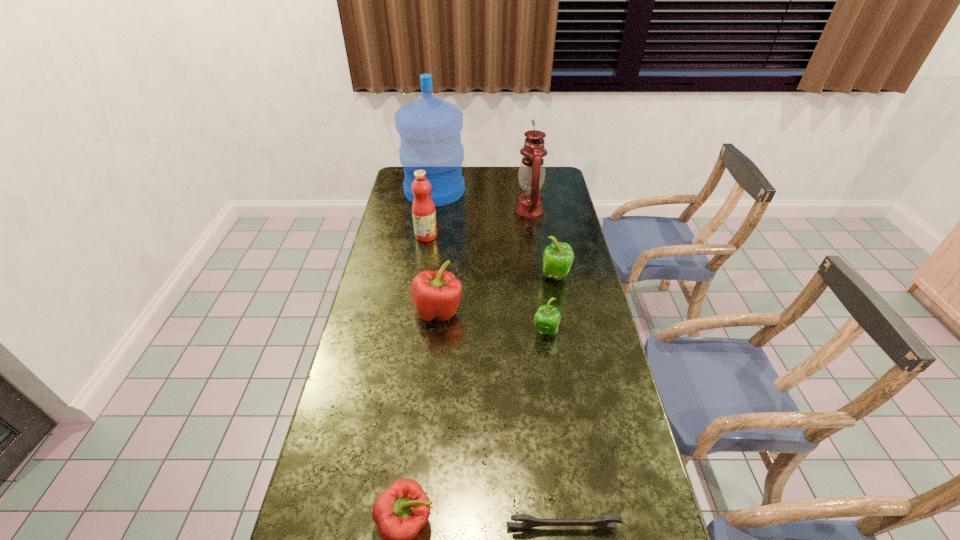
Find the location of a particular element. the shortest object is located at coordinates [x=603, y=522].

In order to click on vacant space located on the right of the water jug in this screenshot , I will do `click(527, 191)`.

Locate an element on the screen. free space located on the left of the oil lamp is located at coordinates (422, 212).

At what (x,y) coordinates should I click in order to perform the action: click on blank space located 0.100m on the front label of the fruit juice. Please return your answer as a coordinate pair (x, y). Looking at the image, I should click on (462, 236).

The image size is (960, 540). I want to click on free space located 0.210m on the left of the farthest bell pepper, so click(x=483, y=276).

Locate an element on the screen. Image resolution: width=960 pixels, height=540 pixels. vacant space situated 0.070m on the back of the farther pink bell pepper is located at coordinates (441, 280).

At what (x,y) coordinates should I click in order to perform the action: click on free space located 0.190m on the back of the nearer green bell pepper. Please return your answer as a coordinate pair (x, y). The width and height of the screenshot is (960, 540). Looking at the image, I should click on (539, 284).

This screenshot has width=960, height=540. I want to click on object at the far edge, so click(430, 128).

The width and height of the screenshot is (960, 540). I want to click on water jug at the left edge, so click(x=430, y=128).

Find the location of a particular element. The width and height of the screenshot is (960, 540). fruit juice located at the left edge is located at coordinates (423, 209).